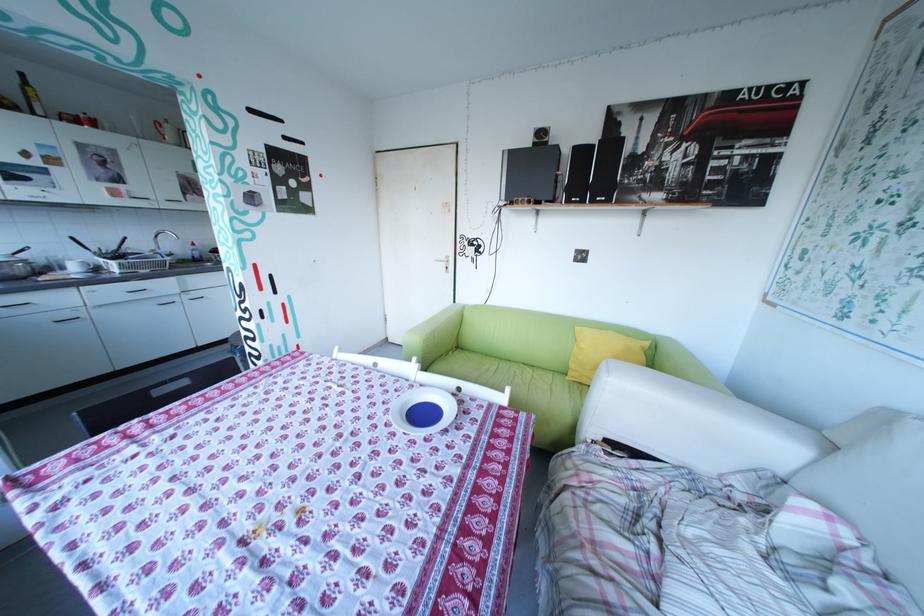
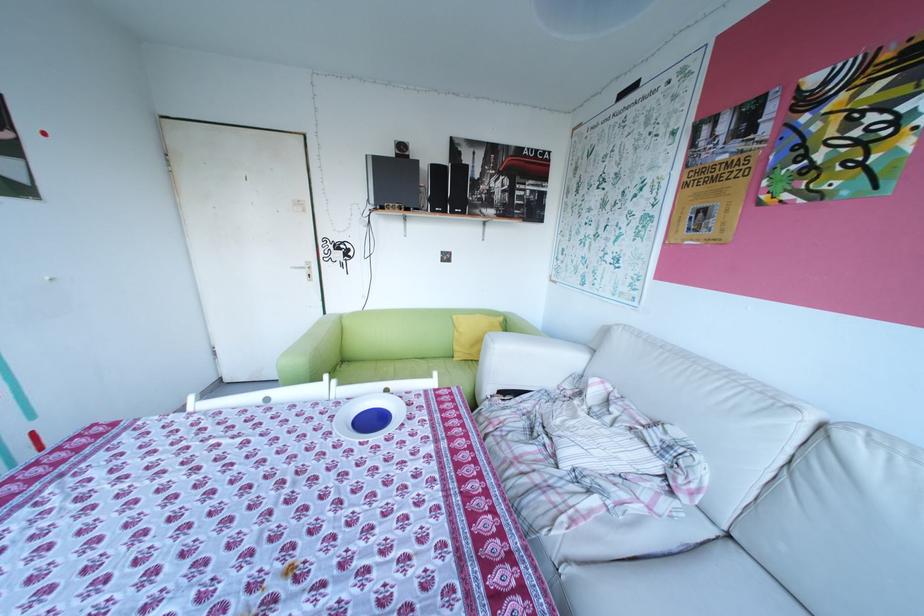
The point at (x=520, y=390) is marked in the first image. Where is the corresponding point in the second image?

(448, 374)